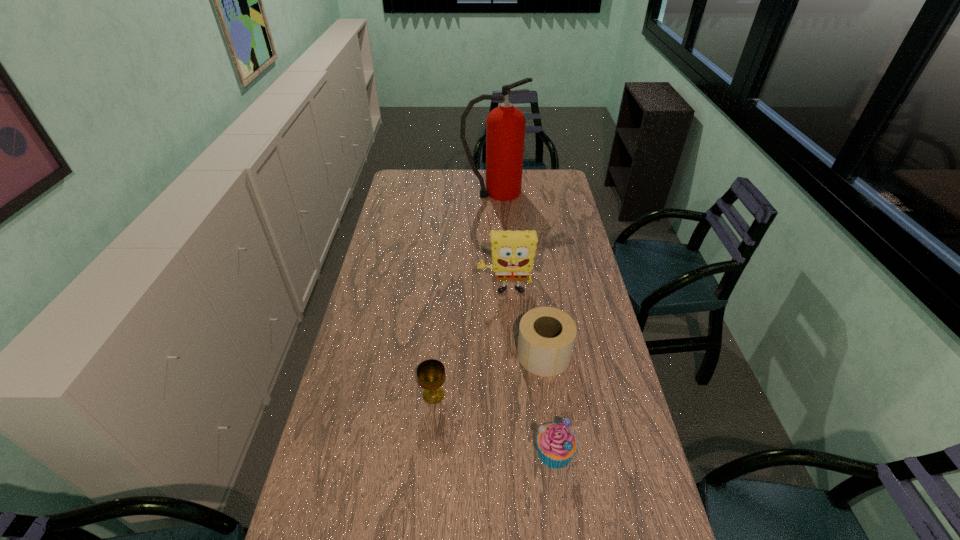
Where is `free spot between the sponge and the second nearest object`? free spot between the sponge and the second nearest object is located at coordinates (469, 343).

The width and height of the screenshot is (960, 540). In order to click on vacant area that lies between the third nearest object and the leftmost object in this screenshot , I will do `click(489, 375)`.

Where is `the second closest object to the toilet tissue`? This screenshot has height=540, width=960. the second closest object to the toilet tissue is located at coordinates (557, 444).

Locate an element on the screen. Image resolution: width=960 pixels, height=540 pixels. object that is the nearest to the sponge is located at coordinates (547, 335).

The image size is (960, 540). Find the location of `blank area in the image that satisfies the following two spatial constraints: 1. on the handle side of the farthest object; 2. on the right side of the muffin`. blank area in the image that satisfies the following two spatial constraints: 1. on the handle side of the farthest object; 2. on the right side of the muffin is located at coordinates (506, 451).

This screenshot has width=960, height=540. Find the location of `free point that satisfies the following two spatial constraints: 1. on the face of the second tallest object; 2. on the left side of the nearest object`. free point that satisfies the following two spatial constraints: 1. on the face of the second tallest object; 2. on the left side of the nearest object is located at coordinates (515, 451).

Locate an element on the screen. The height and width of the screenshot is (540, 960). vacant position in the image that satisfies the following two spatial constraints: 1. on the handle side of the third nearest object; 2. on the right side of the tallest object is located at coordinates [501, 354].

Identify the location of free spot that satisfies the following two spatial constraints: 1. on the back side of the second nearest object; 2. on the right side of the third nearest object. (437, 354).

Locate an element on the screen. The height and width of the screenshot is (540, 960). free region that satisfies the following two spatial constraints: 1. on the handle side of the muffin; 2. on the left side of the fire extinguisher is located at coordinates (506, 451).

Locate an element on the screen. Image resolution: width=960 pixels, height=540 pixels. vacant point that satisfies the following two spatial constraints: 1. on the handle side of the nearest object; 2. on the right side of the tallest object is located at coordinates (506, 451).